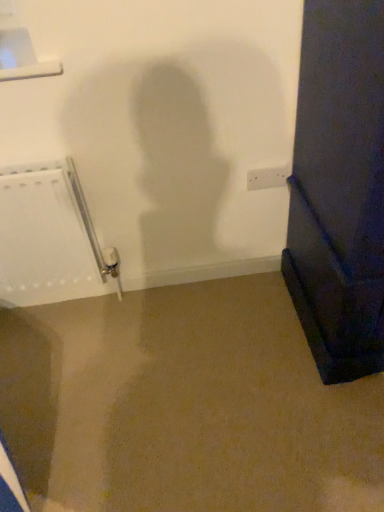
Image resolution: width=384 pixels, height=512 pixels. What do you see at coordinates (49, 238) in the screenshot? I see `white matte radiator at left` at bounding box center [49, 238].

At what (x,y) coordinates should I click in order to perform the action: click on white matte radiator at left. Please return your answer as a coordinate pair (x, y). Looking at the image, I should click on (49, 238).

At what (x,y) coordinates should I click in order to perform the action: click on white plastic electric outlet at center. Please return your answer as a coordinate pair (x, y). Image resolution: width=384 pixels, height=512 pixels. Looking at the image, I should click on (267, 177).

The width and height of the screenshot is (384, 512). What do you see at coordinates (267, 177) in the screenshot?
I see `white plastic electric outlet at center` at bounding box center [267, 177].

Find the location of a particular element. The height and width of the screenshot is (512, 384). white matte radiator at left is located at coordinates (49, 238).

Is white matte radiator at left to the left of white plastic electric outlet at center from the viewer's perspective?

Correct, you'll find white matte radiator at left to the left of white plastic electric outlet at center.

Relative to white plastic electric outlet at center, is white matte radiator at left in front or behind?

Clearly, white matte radiator at left is in front of white plastic electric outlet at center.

Which is behind, point (90, 285) or point (266, 182)?

Positioned behind is point (90, 285).

From the image's perspective, does white matte radiator at left appear higher than white plastic electric outlet at center?

No.

From a real-world perspective, is white matte radiator at left above or below white plastic electric outlet at center?

From a real-world perspective, white matte radiator at left is physically below white plastic electric outlet at center.

Which of these two, white matte radiator at left or white plastic electric outlet at center, is thinner?

With smaller width is white plastic electric outlet at center.

Is white matte radiator at left taller than white plastic electric outlet at center?

Indeed, white matte radiator at left has a greater height compared to white plastic electric outlet at center.

Considering the relative sizes of white matte radiator at left and white plastic electric outlet at center in the image provided, is white matte radiator at left smaller than white plastic electric outlet at center?

No, white matte radiator at left is not smaller than white plastic electric outlet at center.

Is white matte radiator at left outside of white plastic electric outlet at center?

Indeed, white matte radiator at left is completely outside white plastic electric outlet at center.

Are white matte radiator at left and white plastic electric outlet at center far apart?

No, white matte radiator at left is in close proximity to white plastic electric outlet at center.

Is white matte radiator at left facing towards white plastic electric outlet at center?

No, white matte radiator at left is not turned towards white plastic electric outlet at center.

How distant is white matte radiator at left from white plastic electric outlet at center?

white matte radiator at left is 29.79 inches away from white plastic electric outlet at center.

The width and height of the screenshot is (384, 512). Identify the location of radiator below the white plastic electric outlet at center (from a real-world perspective). (49, 238).

Does white plastic electric outlet at center appear on the right side of white matte radiator at left?

Indeed, white plastic electric outlet at center is positioned on the right side of white matte radiator at left.

Does white plastic electric outlet at center come in front of white matte radiator at left?

No, it is behind white matte radiator at left.

Between point (255, 189) and point (20, 275), which one is positioned in front?

The point (255, 189) is closer to the camera.

From the image's perspective, relative to white matte radiator at left, is white plastic electric outlet at center above or below?

white plastic electric outlet at center is above white matte radiator at left.

From a real-world perspective, relative to white matte radiator at left, is white plastic electric outlet at center vertically above or below?

white plastic electric outlet at center is situated higher than white matte radiator at left in the real world.

Which object is thinner, white plastic electric outlet at center or white matte radiator at left?

With smaller width is white plastic electric outlet at center.

From their relative heights in the image, would you say white plastic electric outlet at center is taller or shorter than white matte radiator at left?

Clearly, white plastic electric outlet at center is shorter compared to white matte radiator at left.

Is white plastic electric outlet at center smaller than white matte radiator at left?

Correct, white plastic electric outlet at center occupies less space than white matte radiator at left.

Is white matte radiator at left surrounded by white plastic electric outlet at center?

No, white plastic electric outlet at center does not contain white matte radiator at left.

Is there a large distance between white plastic electric outlet at center and white matte radiator at left?

No.

Is white plastic electric outlet at center aimed at white matte radiator at left?

No, white plastic electric outlet at center is not facing towards white matte radiator at left.

How different are the orientations of white plastic electric outlet at center and white matte radiator at left in degrees?

0.956 degrees separate the facing orientations of white plastic electric outlet at center and white matte radiator at left.

How distant is white plastic electric outlet at center from white matte radiator at left?

The distance of white plastic electric outlet at center from white matte radiator at left is 29.79 inches.

Identify the location of electric outlet lying above the white matte radiator at left (from the image's perspective). This screenshot has width=384, height=512. (267, 177).

Where is `radiator below the white plastic electric outlet at center (from a real-world perspective)`? The image size is (384, 512). radiator below the white plastic electric outlet at center (from a real-world perspective) is located at coordinates (49, 238).

Find the location of `electric outlet that appears above the white matte radiator at left (from the image's perspective)`. electric outlet that appears above the white matte radiator at left (from the image's perspective) is located at coordinates (267, 177).